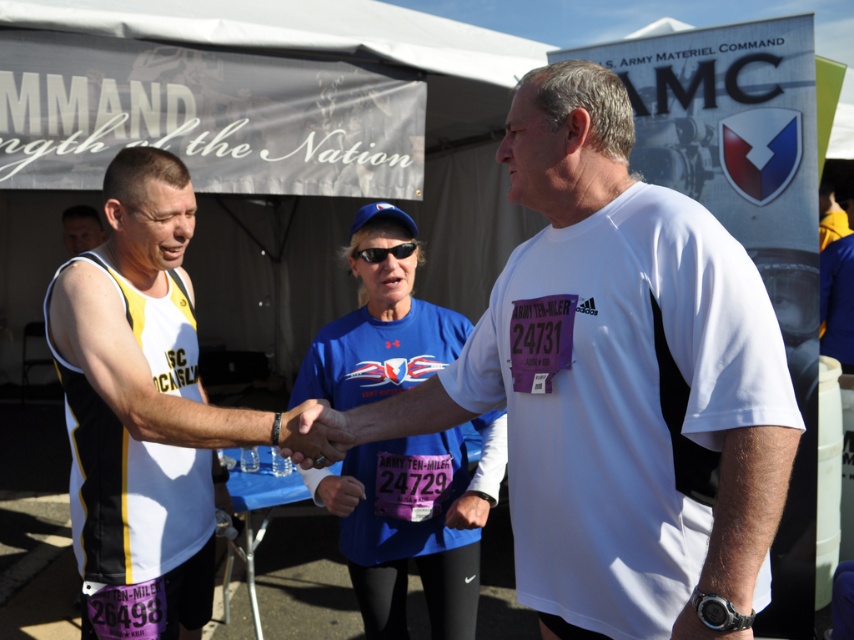
From the picture: Between white jersey at center and blue fabric shirt at center, which one is positioned higher?

white jersey at center is higher up.

Between point (171, 554) and point (307, 392), which one is positioned behind?

Positioned behind is point (307, 392).

Between point (115, 205) and point (459, 344), which one is positioned behind?

Positioned behind is point (459, 344).

At what (x,y) coordinates should I click in order to perform the action: click on white jersey at center. Please return your answer as a coordinate pair (x, y). The width and height of the screenshot is (854, 640). Looking at the image, I should click on (143, 410).

Can you confirm if white matte t-shirt at center is positioned to the right of white jersey at center?

Indeed, white matte t-shirt at center is positioned on the right side of white jersey at center.

Measure the distance between point (547, 81) and camera.

6.56 feet

I want to click on white matte t-shirt at center, so click(619, 385).

Is white matte t-shirt at center further to camera compared to blue fabric shirt at center?

No, white matte t-shirt at center is in front of blue fabric shirt at center.

Can you confirm if white matte t-shirt at center is taller than blue fabric shirt at center?

No, white matte t-shirt at center is not taller than blue fabric shirt at center.

Is point (530, 403) in front of point (360, 352)?

That is True.

You are a GUI agent. You are given a task and a screenshot of the screen. Output one action in this format:
    pyautogui.click(x=<x>, y=<y>)
    Task: Click on the white matte t-shirt at center
    The width and height of the screenshot is (854, 640).
    Given the screenshot: What is the action you would take?
    pyautogui.click(x=619, y=385)